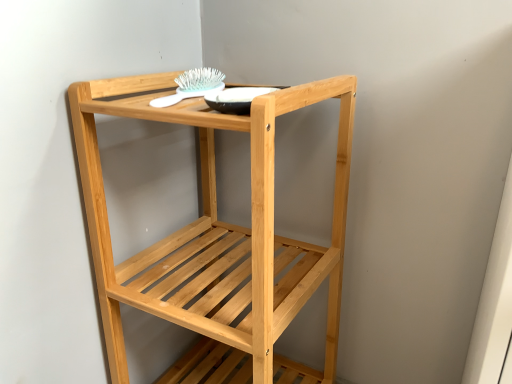
Question: Is matte black bowl at upper center surrounded by white plastic brush at upper center?

Choices:
 (A) no
 (B) yes

Answer: (A)

Question: Is white plastic brush at upper center behind matte black bowl at upper center?

Choices:
 (A) yes
 (B) no

Answer: (A)

Question: Considering the relative positions of white plastic brush at upper center and matte black bowl at upper center in the image provided, is white plastic brush at upper center to the right of matte black bowl at upper center from the viewer's perspective?

Choices:
 (A) no
 (B) yes

Answer: (A)

Question: Would you say white plastic brush at upper center is a long distance from matte black bowl at upper center?

Choices:
 (A) yes
 (B) no

Answer: (B)

Question: Considering the relative sizes of white plastic brush at upper center and matte black bowl at upper center in the image provided, is white plastic brush at upper center wider than matte black bowl at upper center?

Choices:
 (A) yes
 (B) no

Answer: (A)

Question: Considering the relative positions of white plastic brush at upper center and matte black bowl at upper center in the image provided, is white plastic brush at upper center to the left of matte black bowl at upper center from the viewer's perspective?

Choices:
 (A) no
 (B) yes

Answer: (B)

Question: Is matte black bowl at upper center facing away from white plastic brush at upper center?

Choices:
 (A) yes
 (B) no

Answer: (B)

Question: Can you confirm if matte black bowl at upper center is bigger than white plastic brush at upper center?

Choices:
 (A) no
 (B) yes

Answer: (A)

Question: Can we say matte black bowl at upper center lies outside white plastic brush at upper center?

Choices:
 (A) yes
 (B) no

Answer: (A)

Question: From a real-world perspective, is matte black bowl at upper center positioned over white plastic brush at upper center based on gravity?

Choices:
 (A) yes
 (B) no

Answer: (A)

Question: From the image's perspective, is matte black bowl at upper center under white plastic brush at upper center?

Choices:
 (A) yes
 (B) no

Answer: (A)

Question: Is matte black bowl at upper center aimed at white plastic brush at upper center?

Choices:
 (A) no
 (B) yes

Answer: (A)

Question: Can you confirm if natural wood shelf at center is thinner than matte black bowl at upper center?

Choices:
 (A) no
 (B) yes

Answer: (A)